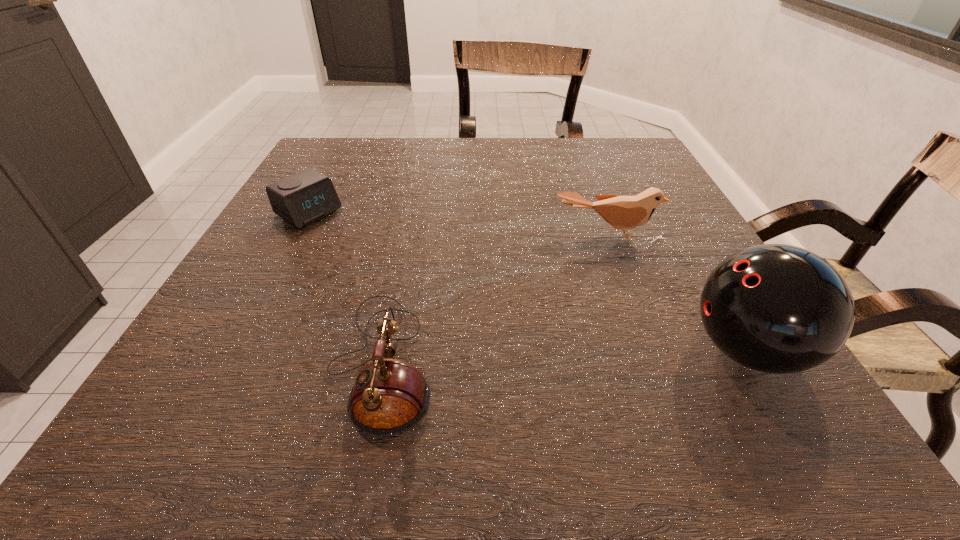
Choose which object is the nearest neighbor to the bird. Please provide its 2D coordinates. Your answer should be formatted as a tuple, i.e. [(x, y)], where the tuple contains the x and y coordinates of a point satisfying the conditions above.

[(775, 308)]

Find the location of `the second closest object to the bird`. the second closest object to the bird is located at coordinates (390, 396).

Find the location of `free region that satisfies the following two spatial constraints: 1. on the front side of the tallest object; 2. on the surface of the leftmost object near the finger holes`. free region that satisfies the following two spatial constraints: 1. on the front side of the tallest object; 2. on the surface of the leftmost object near the finger holes is located at coordinates click(234, 350).